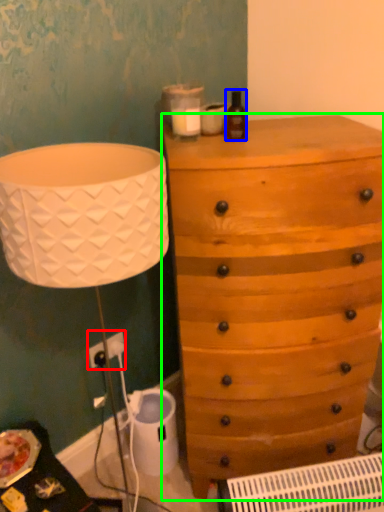
Question: Considering the real-world distances, which object is closest to electric outlet (highlighted by a red box)? bottle (highlighted by a blue box) or chest of drawers (highlighted by a green box).

Choices:
 (A) bottle
 (B) chest of drawers

Answer: (B)